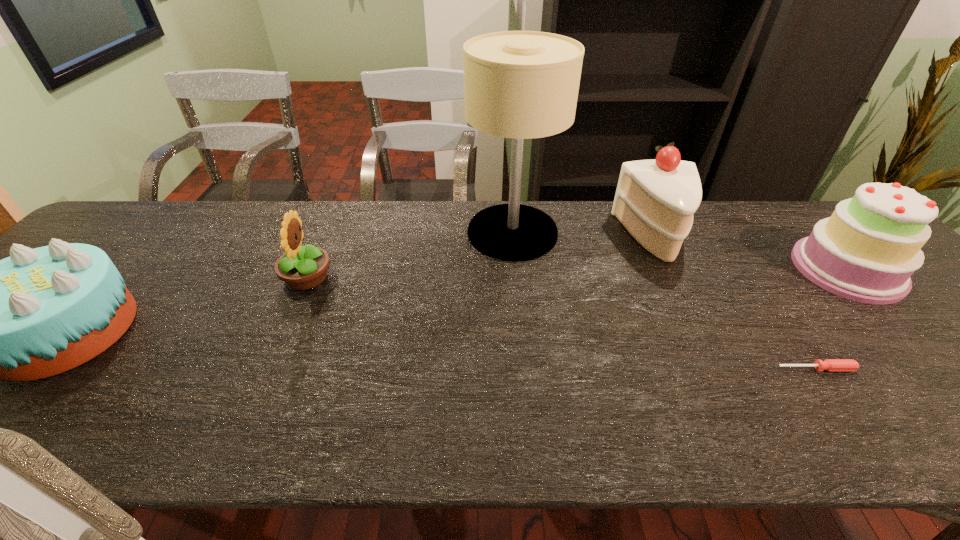
I want to click on the third object from left to right, so click(x=522, y=85).

This screenshot has height=540, width=960. I want to click on table lamp, so pyautogui.click(x=522, y=85).

You are a GUI agent. You are given a task and a screenshot of the screen. Output one action in this format:
    pyautogui.click(x=<x>, y=<y>)
    Task: Click on the second cake from left to right
    This screenshot has height=540, width=960.
    Given the screenshot: What is the action you would take?
    pyautogui.click(x=655, y=200)

The height and width of the screenshot is (540, 960). Find the location of `the rightmost cake`. the rightmost cake is located at coordinates (867, 250).

Where is `the second object from left to right`? the second object from left to right is located at coordinates (302, 268).

The image size is (960, 540). I want to click on the shortest object, so click(832, 365).

Locate an element on the screen. The image size is (960, 540). screwdriver is located at coordinates (x=832, y=365).

What are the coordinates of `vacant space located 0.300m on the right of the third object from left to right` in the screenshot? It's located at (660, 233).

At what (x,y) coordinates should I click in order to perform the action: click on vacant space located 0.260m on the front of the second cake from right to left. Please return your answer as a coordinate pair (x, y). The width and height of the screenshot is (960, 540). Looking at the image, I should click on (707, 339).

At what (x,y) coordinates should I click in order to perform the action: click on vacant space situated 0.230m on the left of the rightmost object. Please return your answer as a coordinate pair (x, y). The width and height of the screenshot is (960, 540). Looking at the image, I should click on (710, 269).